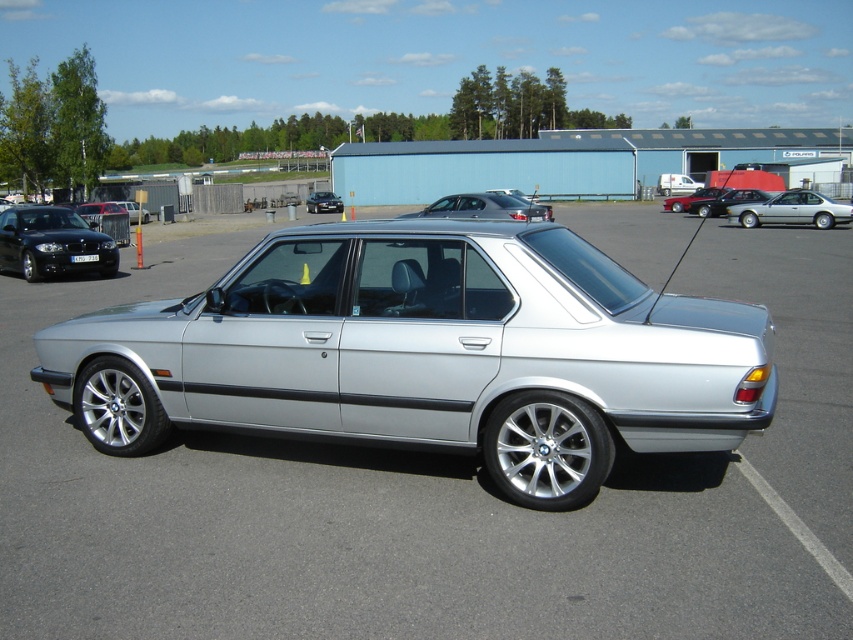
Looking at this image, you are a parking attendant and need to guide a driver to park their car between the shiny black sedan at left and the silver metallic sedan at right. Based on their current positions, is there enough space for the driver to park their car in between them?

The shiny black sedan at left is positioned to the left of the silver metallic sedan at right, so there is space between them for the driver to park their car in between.

You are a delivery driver who needs to park your truck in the parking lot. The truck is 2 meters wide. The satin silver sedan at right and the white plastic license plate at center are in the way. Can you fit your truck between them?

The satin silver sedan at right is thinner than the white plastic license plate at center. However, the distance between them isn not provided, so we cannot determine if the truck can fit. Please check the actual space between the two objects.

You are a parking attendant and need to move the silver metallic sedan at center. Can you move it without disturbing the shiny black sedan at center?

The silver metallic sedan at center is positioned under the shiny black sedan at center, so you cannot move it without first moving the shiny black sedan at center.